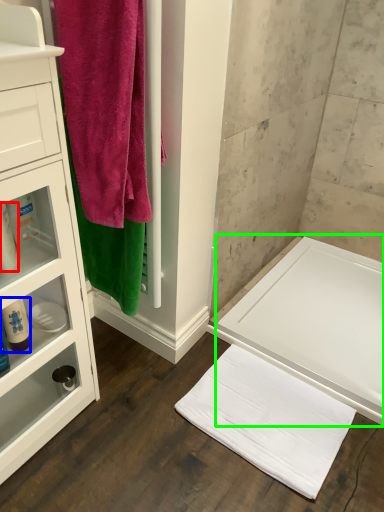
Question: Estimate the real-world distances between objects in this image. Which object is farther from toiletry (highlighted by a red box), cleaning product (highlighted by a blue box) or bath (highlighted by a green box)?

Choices:
 (A) cleaning product
 (B) bath

Answer: (B)